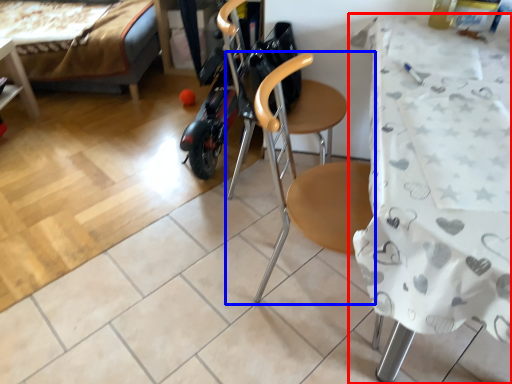
Question: Which of the following is the farthest to the observer, table (highlighted by a red box) or chair (highlighted by a blue box)?

Choices:
 (A) table
 (B) chair

Answer: (B)